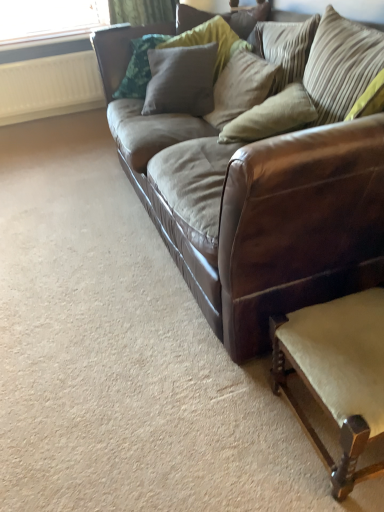
Question: Relative to brown leather couch at center, is textured gray pillow at upper center, the 4th pillow from the right, in front or behind?

Choices:
 (A) front
 (B) behind

Answer: (B)

Question: From a real-world perspective, relative to brown leather couch at center, is textured gray pillow at upper center, the 4th pillow from the right, vertically above or below?

Choices:
 (A) below
 (B) above

Answer: (B)

Question: Which is farther from the striped fabric pillow at upper right, placed as the 1th pillow when sorted from right to left?

Choices:
 (A) white ribbed radiator at upper left
 (B) brown leather couch at center
 (C) textured beige pillow at upper center, arranged as the 3th pillow when viewed from the right
 (D) textured gray pillow at upper center, the 4th pillow from the right
 (E) beige fabric pillow at center, which is the second pillow from right to left

Answer: (A)

Question: Estimate the real-world distances between objects in this image. Which object is closer to the light beige fabric swivel chair at lower right?

Choices:
 (A) textured beige pillow at upper center, arranged as the 3th pillow when viewed from the right
 (B) striped fabric pillow at upper right, the fourth pillow positioned from the left
 (C) white ribbed radiator at upper left
 (D) brown leather couch at center
 (E) textured gray pillow at upper center, arranged as the 1th pillow when viewed from the left

Answer: (D)